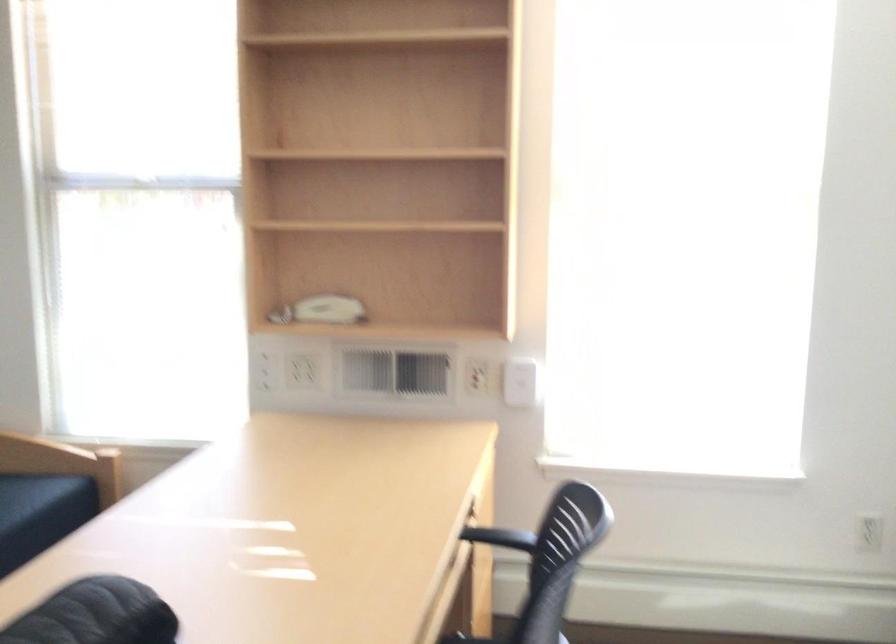
Where would you rest the black chair armrest? Please return your answer as a coordinate pair (x, y).

(504, 536)